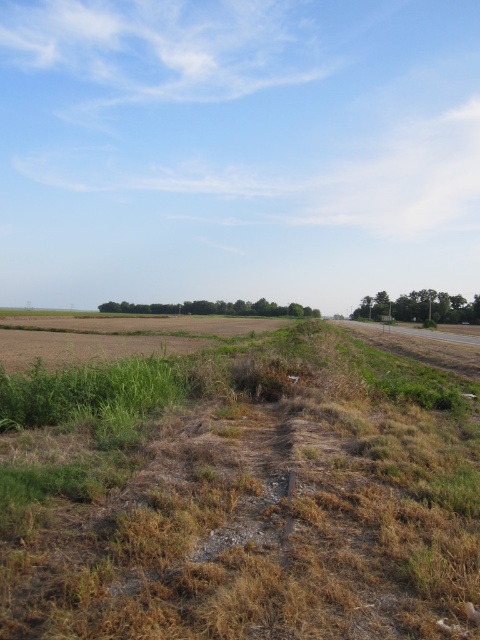
Question: Which point is closer to the camera taking this photo?

Choices:
 (A) (166, 330)
 (B) (97, 563)

Answer: (B)

Question: Is brown dry grass at lower left further to the viewer compared to brown grassy dirt field at lower left?

Choices:
 (A) yes
 (B) no

Answer: (B)

Question: Which of the following is the farthest from the observer?

Choices:
 (A) (164, 323)
 (B) (277, 433)

Answer: (A)

Question: Is brown dry grass at lower left in front of brown grassy dirt field at lower left?

Choices:
 (A) yes
 (B) no

Answer: (A)

Question: Is brown dry grass at lower left to the right of brown grassy dirt field at lower left from the viewer's perspective?

Choices:
 (A) no
 (B) yes

Answer: (B)